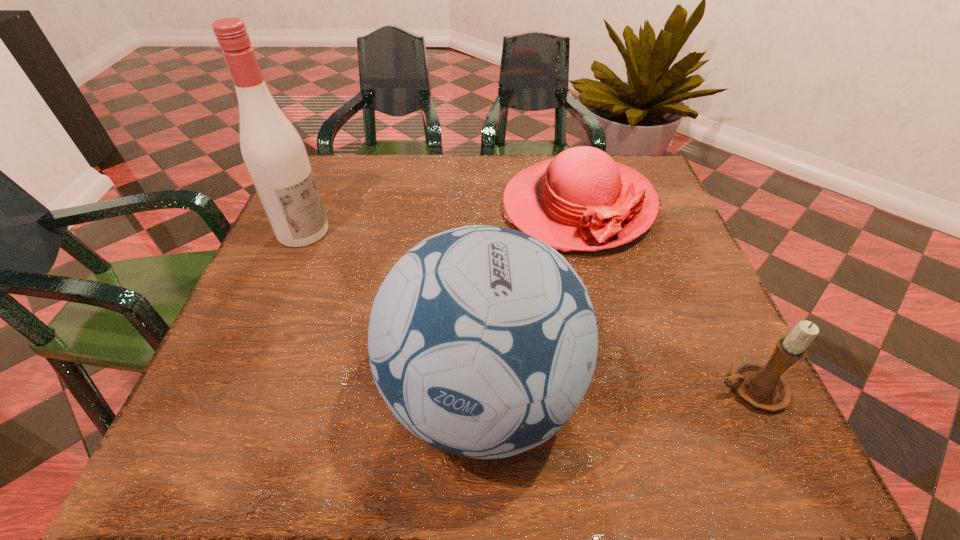
Find the location of a particular element. The image size is (960, 540). object located in the far right corner section of the desktop is located at coordinates (582, 200).

At what (x,y) coordinates should I click in order to perform the action: click on object that is at the near right corner. Please return your answer as a coordinate pair (x, y). The height and width of the screenshot is (540, 960). Looking at the image, I should click on (761, 385).

Locate an element on the screen. The image size is (960, 540). vacant space at the far edge is located at coordinates (396, 170).

Find the location of a particular element. vacant area at the near edge of the desktop is located at coordinates (316, 399).

Where is `free region at the left edge of the desktop`? free region at the left edge of the desktop is located at coordinates (267, 277).

I want to click on blank space at the right edge, so click(677, 318).

In the image, there is a desktop. At what (x,y) coordinates should I click in order to perform the action: click on vacant space at the far left corner. Please return your answer as a coordinate pair (x, y). The image size is (960, 540). Looking at the image, I should click on (339, 171).

This screenshot has height=540, width=960. I want to click on free space at the near left corner, so click(x=273, y=381).

Where is `free area in between the shortest object and the candle holder`? free area in between the shortest object and the candle holder is located at coordinates (663, 298).

At what (x,y) coordinates should I click in order to perform the action: click on vacant space in between the second shortest object and the soccer ball. Please return your answer as a coordinate pair (x, y). Looking at the image, I should click on (616, 392).